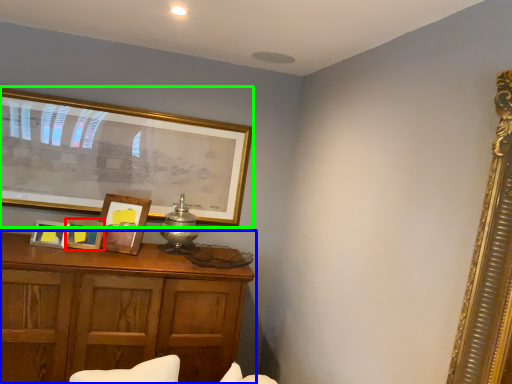
Question: Estimate the real-world distances between objects in this image. Which object is closer to picture frame (highlighted by a red box), table (highlighted by a blue box) or picture frame (highlighted by a green box)?

Choices:
 (A) table
 (B) picture frame

Answer: (A)